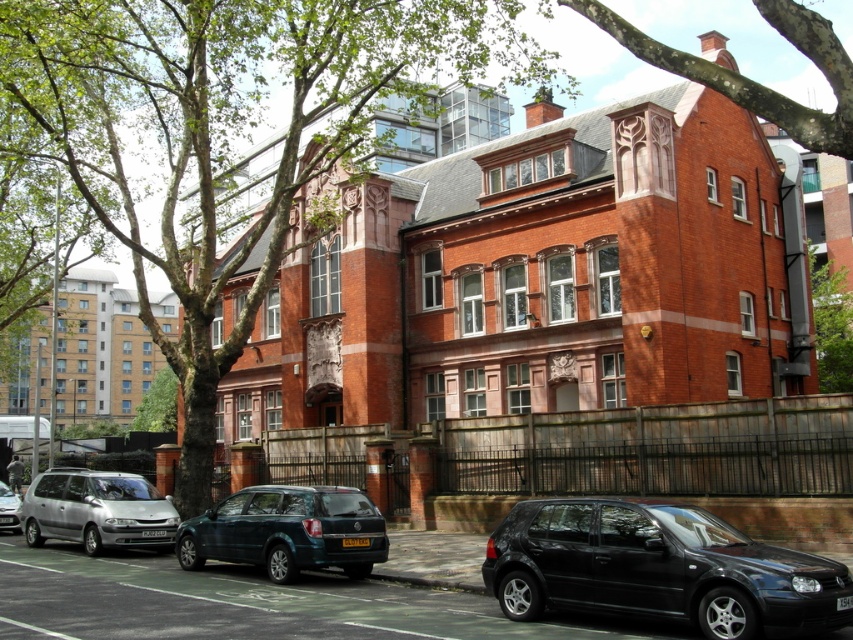
You are standing at the center of the street facing the red brick building. You see a point marked at coordinate (659, 568). Which object is this point located on?

The point at coordinate (659, 568) is located on the black matte hatchback at lower right.

You are a pedestrian standing on the sidewalk in front of the red brick building. You want to walk to the street to catch a bus. Which object, the green leafy tree at upper center or the silver metallic minivan at lower left, would you pass by first?

The green leafy tree at upper center is in front of the silver metallic minivan at lower left, so you would pass by the green leafy tree at upper center first before reaching the street.

You are a delivery person approaching the building and need to park your vehicle. You see a metallic green suv at lower center and a silver metallic van at lower left. Which vehicle is closer to the building?

The metallic green suv at lower center is closer to the building because it is positioned above the silver metallic van at lower left, indicating it is nearer in the scene.